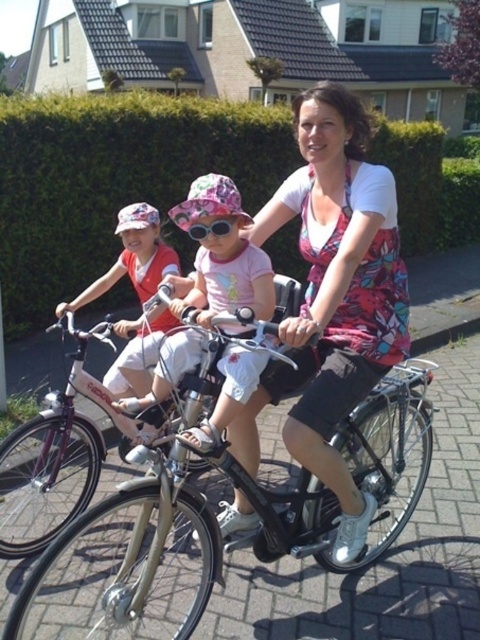
Does pink fabric hat at upper left have a greater width compared to pink fabric goggles at center?

Yes.

Based on the photo, is pink fabric hat at upper left shorter than pink fabric goggles at center?

Incorrect, pink fabric hat at upper left's height does not fall short of pink fabric goggles at center's.

Does point (164, 269) come closer to viewer compared to point (229, 227)?

No, it is behind (229, 227).

Locate an element on the screen. The height and width of the screenshot is (640, 480). pink fabric hat at upper left is located at coordinates (133, 257).

Can you confirm if shiny gold bicycle at center is shorter than pink fabric goggles at center?

Incorrect, shiny gold bicycle at center's height does not fall short of pink fabric goggles at center's.

Where is `shiny gold bicycle at center`? The image size is (480, 640). shiny gold bicycle at center is located at coordinates (126, 561).

Between point (403, 497) and point (240, 221), which one is positioned in front?

Point (240, 221) is in front.

Find the location of a particular element. This screenshot has height=640, width=480. shiny gold bicycle at center is located at coordinates (126, 561).

Is green leafy hedge at upper center wider than pink fabric goggles at center?

A: Yes.

Which is below, green leafy hedge at upper center or pink fabric goggles at center?

pink fabric goggles at center is below.

I want to click on green leafy hedge at upper center, so click(113, 179).

Find the location of a particular element. green leafy hedge at upper center is located at coordinates (113, 179).